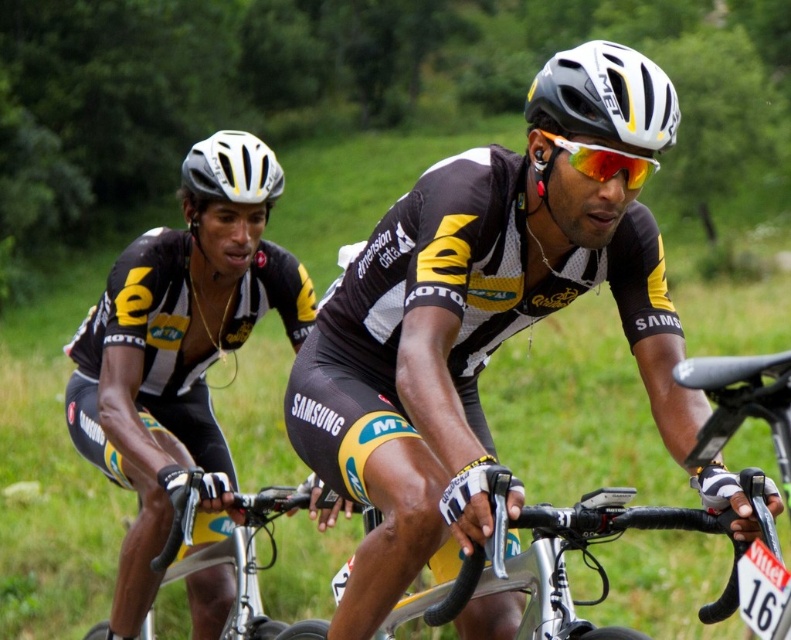
In the scene shown: You are standing at the point marked by the coordinates point [539,224]. A cyclist wearing a white helmet with black accents and reflective orange sunglasses is approaching from behind you. Can you safely turn around to face them without moving from your current position?

The point marked by the coordinates point [539,224] and the viewer are 3.49 meters apart. Since the distance between you and the point is 3.49 meters, you can safely turn around to face the cyclist without needing to move from your current position as there is enough space.

You are a photographer positioned at the side of the path where the cyclists are racing. You need to capture a photo that includes both the white matte bicycle helmet at upper center and the red reflective lens glasses at center. Based on their positions, which object should you focus on first to ensure both are in frame?

The white matte bicycle helmet at upper center is to the right of red reflective lens glasses at center. To include both in the frame, focus on the red reflective lens glasses at center first since it is on the left, then adjust to include the helmet on the right.